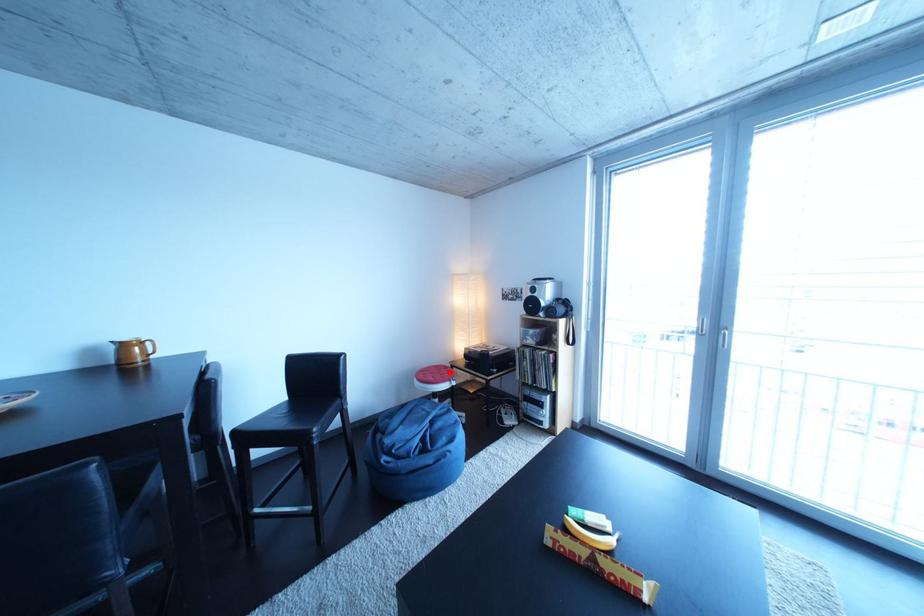
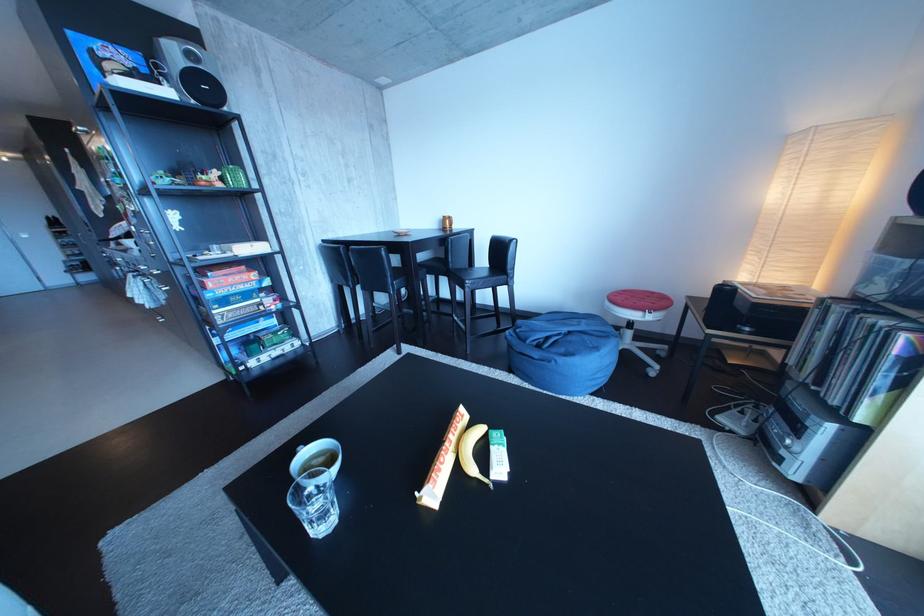
Locate, in the second image, the point that corresponds to the highlighted location in the first image.

(666, 299)